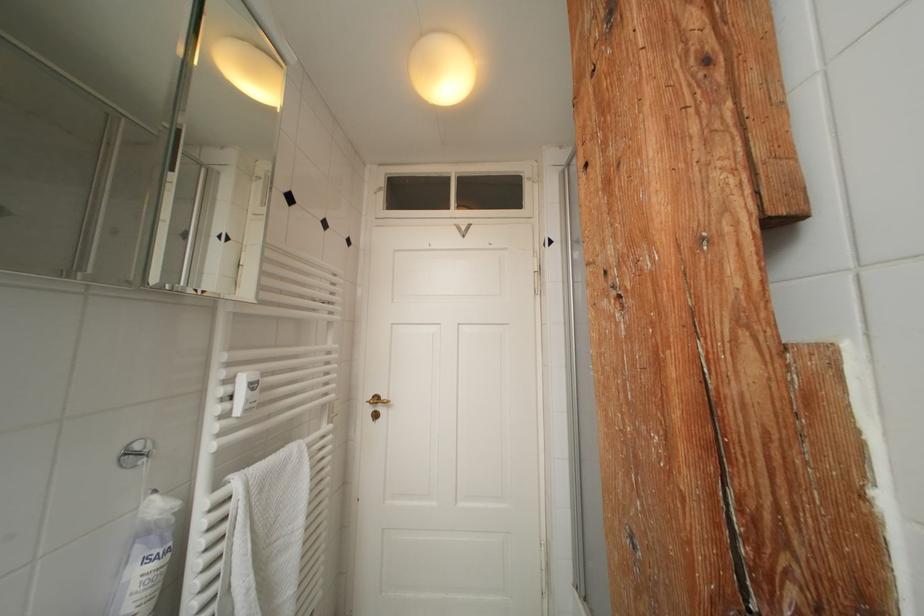
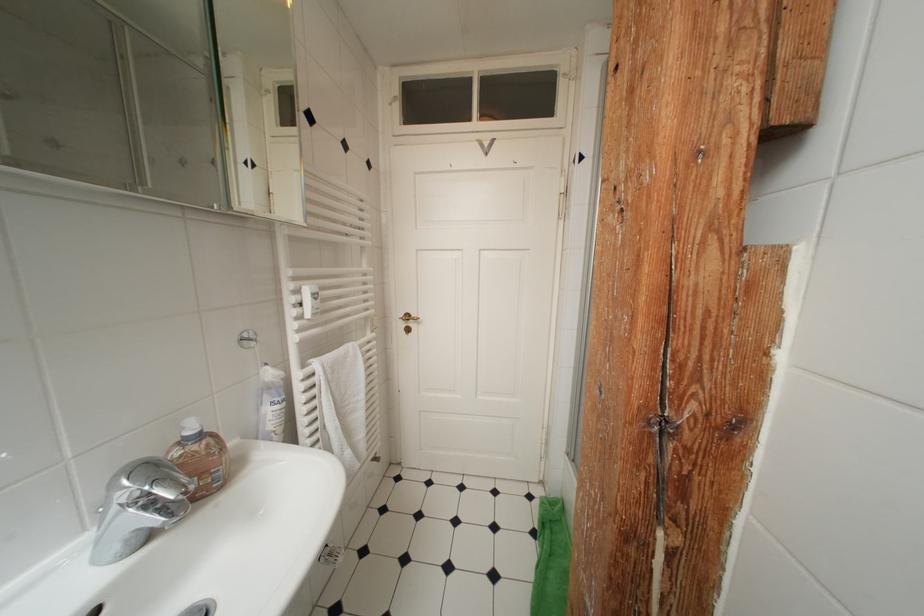
Question: How did the camera likely rotate?

Choices:
 (A) Left
 (B) Right
 (C) Up
 (D) Down

Answer: (D)